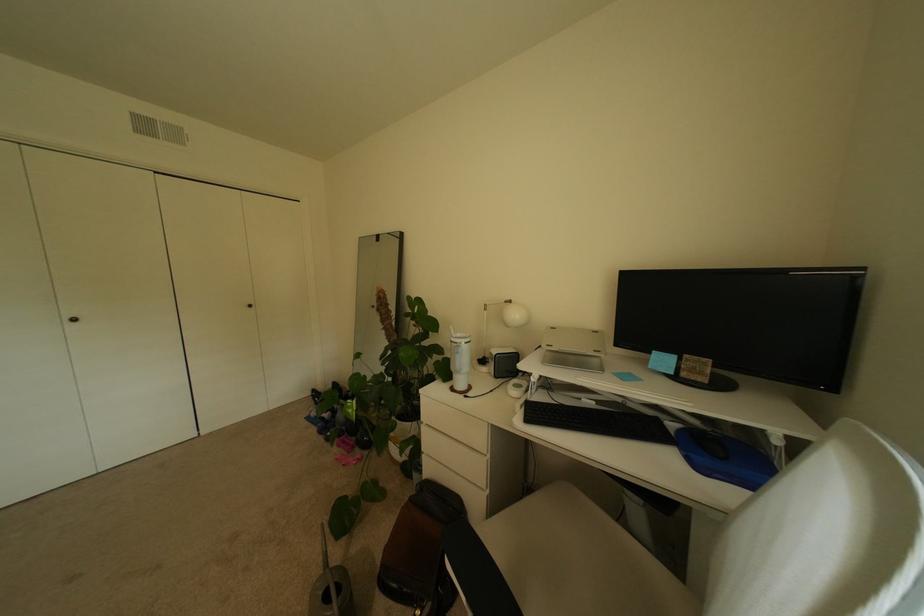
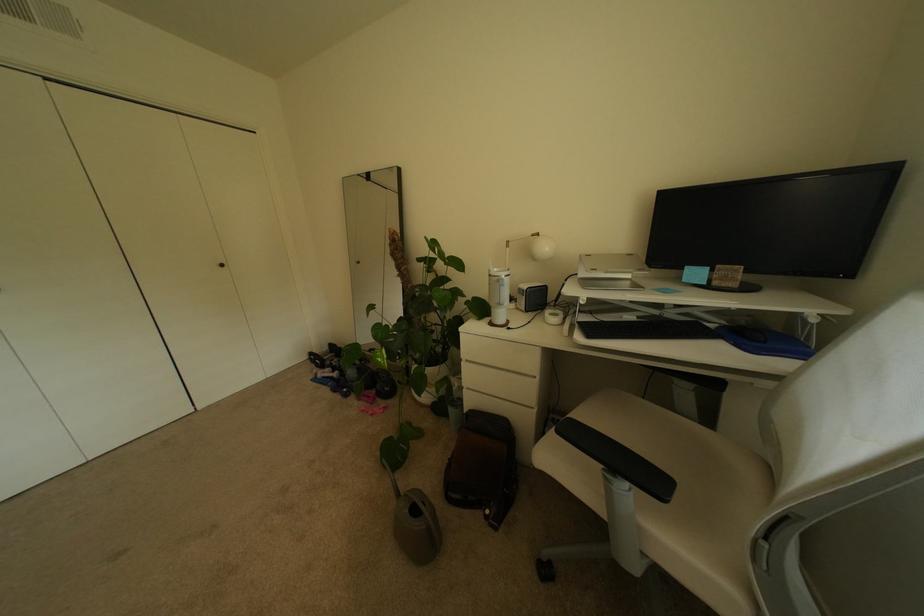
In the second image, find the point that corresponds to (x=537, y=421) in the first image.

(598, 337)